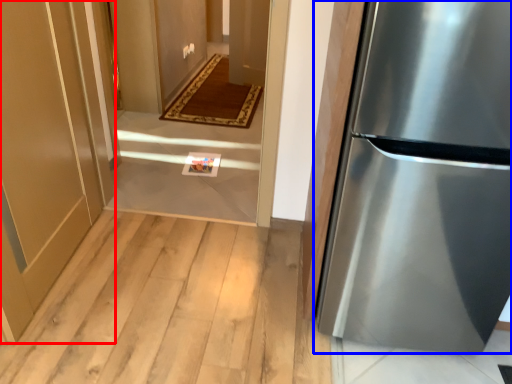
Question: Among these objects, which one is nearest to the camera, door (highlighted by a red box) or refrigerator (highlighted by a blue box)?

Choices:
 (A) door
 (B) refrigerator

Answer: (B)